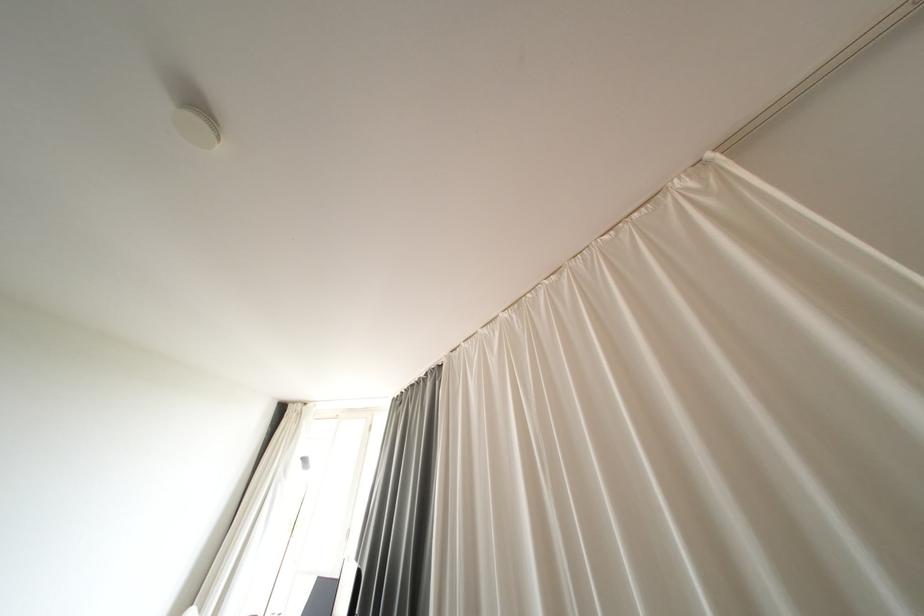
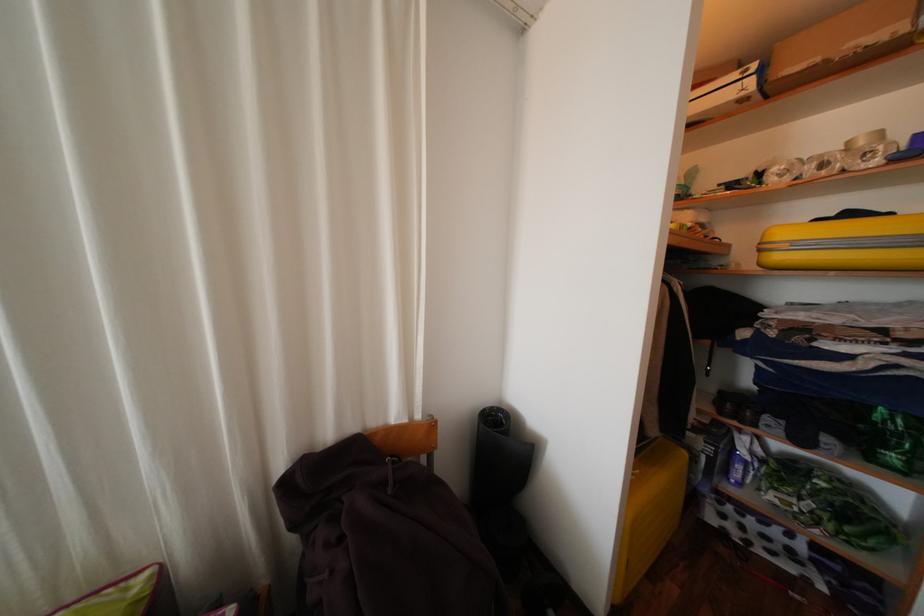
Question: How did the camera likely rotate?

Choices:
 (A) Left
 (B) Right
 (C) Up
 (D) Down

Answer: (B)